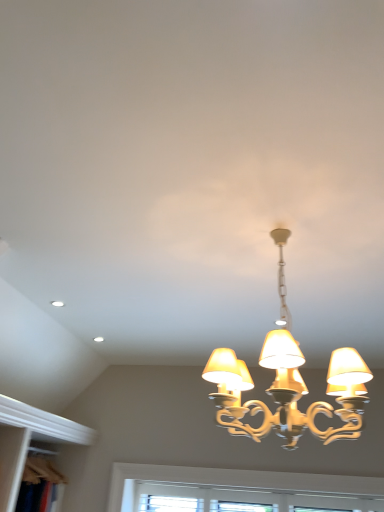
Question: Can you confirm if white textured window at lower center is positioned to the left of gold metallic chandelier at center?

Choices:
 (A) no
 (B) yes

Answer: (A)

Question: Does white textured window at lower center appear on the right side of gold metallic chandelier at center?

Choices:
 (A) yes
 (B) no

Answer: (A)

Question: Can you see white textured window at lower center touching gold metallic chandelier at center?

Choices:
 (A) yes
 (B) no

Answer: (B)

Question: Is white textured window at lower center looking in the opposite direction of gold metallic chandelier at center?

Choices:
 (A) yes
 (B) no

Answer: (B)

Question: Can you confirm if white textured window at lower center is thinner than gold metallic chandelier at center?

Choices:
 (A) no
 (B) yes

Answer: (B)

Question: Do you think wooden bookshelf at lower left is within gold metallic chandelier at center, or outside of it?

Choices:
 (A) inside
 (B) outside

Answer: (B)

Question: From a real-world perspective, is wooden bookshelf at lower left positioned above or below gold metallic chandelier at center?

Choices:
 (A) below
 (B) above

Answer: (A)

Question: Considering the positions of wooden bookshelf at lower left and gold metallic chandelier at center in the image, is wooden bookshelf at lower left bigger or smaller than gold metallic chandelier at center?

Choices:
 (A) small
 (B) big

Answer: (A)

Question: From the image's perspective, relative to gold metallic chandelier at center, is wooden bookshelf at lower left above or below?

Choices:
 (A) above
 (B) below

Answer: (B)

Question: From their relative heights in the image, would you say gold metallic chandelier at center is taller or shorter than wooden bookshelf at lower left?

Choices:
 (A) tall
 (B) short

Answer: (A)

Question: Looking at their shapes, would you say gold metallic chandelier at center is wider or thinner than wooden bookshelf at lower left?

Choices:
 (A) wide
 (B) thin

Answer: (A)

Question: Considering the positions of point (292, 436) and point (34, 477), is point (292, 436) closer or farther from the camera than point (34, 477)?

Choices:
 (A) closer
 (B) farther

Answer: (A)

Question: From a real-world perspective, is gold metallic chandelier at center above or below wooden bookshelf at lower left?

Choices:
 (A) above
 (B) below

Answer: (A)

Question: Considering the positions of gold metallic chandelier at center and white textured window at lower center in the image, is gold metallic chandelier at center taller or shorter than white textured window at lower center?

Choices:
 (A) tall
 (B) short

Answer: (A)

Question: Is gold metallic chandelier at center spatially inside white textured window at lower center, or outside of it?

Choices:
 (A) outside
 (B) inside

Answer: (A)